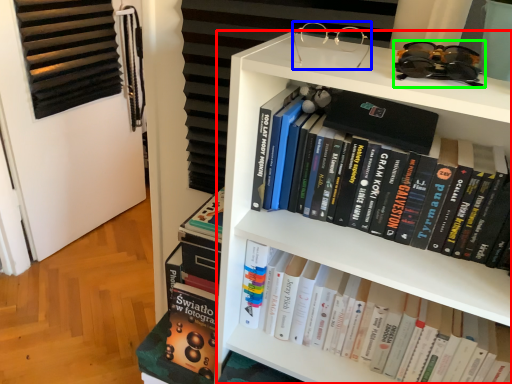
Question: Which object is the closest to the bookcase (highlighted by a red box)? Choose among these: glasses (highlighted by a blue box) or glasses (highlighted by a green box).

Choices:
 (A) glasses
 (B) glasses

Answer: (B)